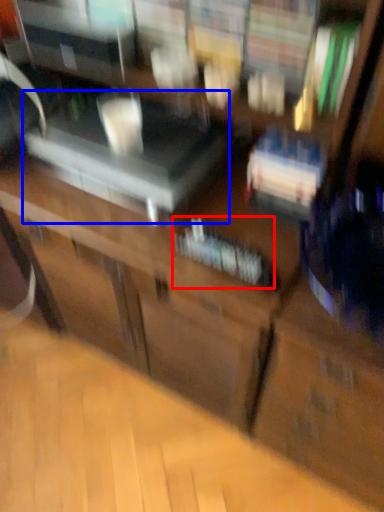
Question: Among these objects, which one is nearest to the camera, book (highlighted by a red box) or furniture (highlighted by a blue box)?

Choices:
 (A) book
 (B) furniture

Answer: (A)